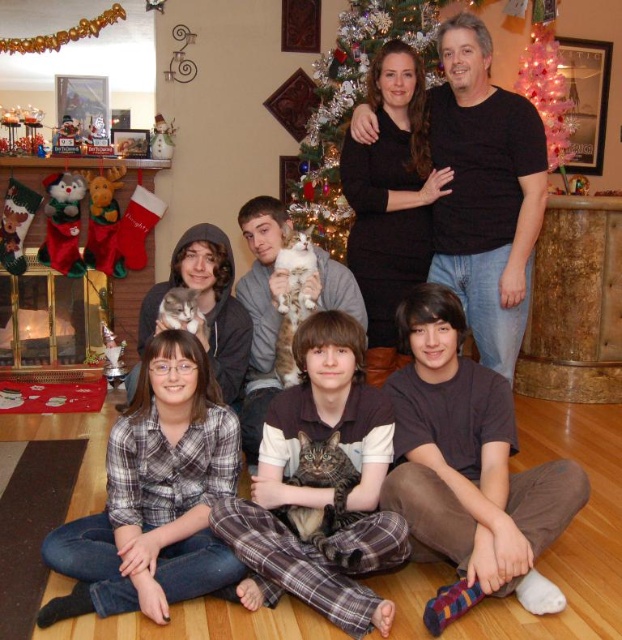
You are a photographer positioned in front of the Christmas tree. You want to take a photo that includes both the plaid shirt at lower left and the pink glittering christmas tree at upper center. Which object should you pan your camera towards first to ensure both are in frame?

To include both the plaid shirt at lower left and the pink glittering christmas tree at upper center in the photo, you should pan your camera towards the plaid shirt at lower left first since it is positioned to the left of the pink glittering christmas tree at upper center.

You are a photographer setting up for a family photo. You notice a striped fabric cat at center and a pink glittering christmas tree at upper center. Which object should you focus on first if you want to capture the larger subject in your shot?

The striped fabric cat at center has a larger size compared to pink glittering christmas tree at upper center, so you should focus on the striped fabric cat at center first to capture the larger subject.

You are standing in the living room and want to place a gift box at the point marked by coordinates point (x=379, y=602). If the gift box requires 7 feet of space from the camera to avoid being too close, will this point be suitable?

The distance of point (x=379, y=602) from camera is 6.97 feet, which is just slightly less than the required 7 feet. Therefore, placing the gift box at this point may be too close and not suitable.